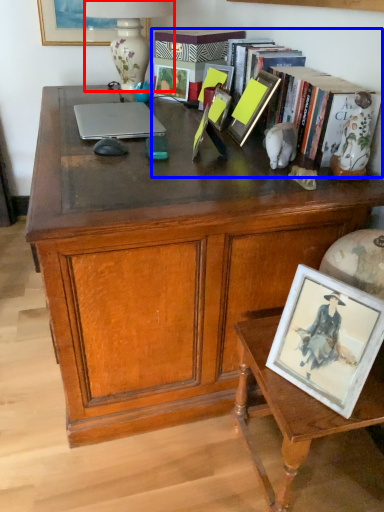
Question: Among these objects, which one is farthest to the camera, lamp (highlighted by a red box) or book (highlighted by a blue box)?

Choices:
 (A) lamp
 (B) book

Answer: (A)